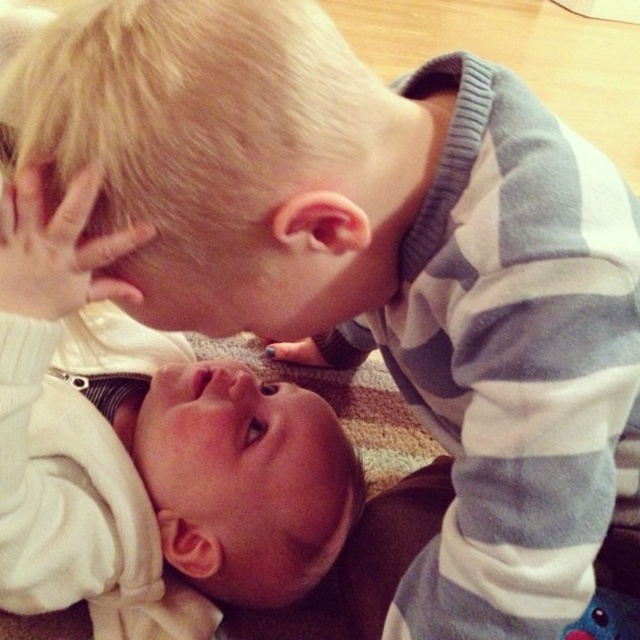
You are standing in a room and see a point marked at coordinates (22,481). If you want to place a small toy that requires 20 inches of space in front of you, will there be enough space between you and that point?

The point at coordinates (22,481) is 24.11 inches from the viewer. Since the toy requires 20 inches of space, there is enough space between you and the point to place the toy.

You are a photographer setting up for a family photo. You need to position a stool so that the white soft baby at center can sit comfortably while still being visible above the blonde hair at upper center. Is the current height difference between them sufficient for this setup?

The white soft baby at center is much taller than the blonde hair at upper center. Since the baby is already taller, placing a stool might make the baby even taller, potentially obscuring the blonde hair at upper center. Adjust the stool height carefully to ensure visibility.

You are a photographer setting up a shot of the two children in the scene. You want to ensure the white soft baby at center and the blonde hair at upper center are both in focus. Since the depth of field is limited, you need to adjust the camera so that both are sharp. Based on their positions, which child should you focus on to achieve this?

You should focus on the white soft baby at center because it is positioned under the blonde hair at upper center, meaning they are at a similar distance from the camera. This shared proximity ensures both will be in focus with the limited depth of field.